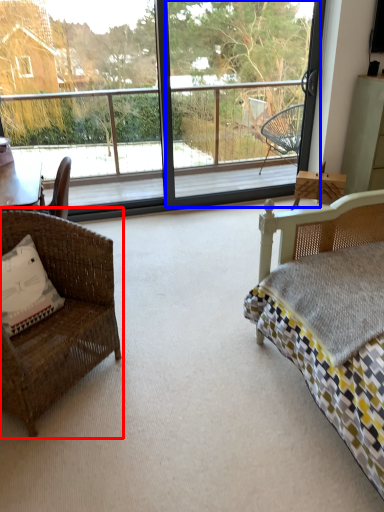
Question: Among these objects, which one is farthest to the camera, chair (highlighted by a red box) or screen door (highlighted by a blue box)?

Choices:
 (A) chair
 (B) screen door

Answer: (B)